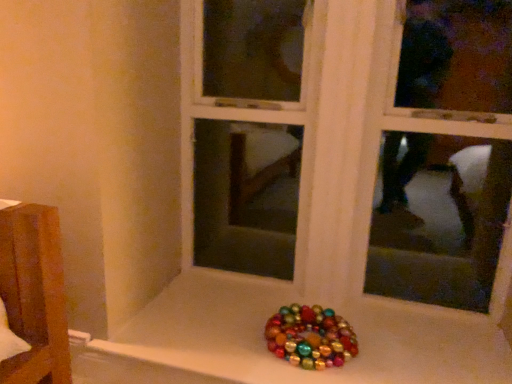
Question: Is multicolored glossy beads at bottom center looking in the opposite direction of metallic shiny ornaments at bottom?

Choices:
 (A) yes
 (B) no

Answer: (A)

Question: Is multicolored glossy beads at bottom center at the right side of metallic shiny ornaments at bottom?

Choices:
 (A) no
 (B) yes

Answer: (A)

Question: Can you confirm if multicolored glossy beads at bottom center is thinner than metallic shiny ornaments at bottom?

Choices:
 (A) no
 (B) yes

Answer: (A)

Question: Considering the relative sizes of multicolored glossy beads at bottom center and metallic shiny ornaments at bottom in the image provided, is multicolored glossy beads at bottom center smaller than metallic shiny ornaments at bottom?

Choices:
 (A) no
 (B) yes

Answer: (B)

Question: Is multicolored glossy beads at bottom center taller than metallic shiny ornaments at bottom?

Choices:
 (A) no
 (B) yes

Answer: (A)

Question: From the image's perspective, is multicolored glossy beads at bottom center below metallic shiny ornaments at bottom?

Choices:
 (A) no
 (B) yes

Answer: (B)

Question: Can you confirm if metallic shiny ornaments at bottom is wider than multicolored glossy beads at bottom center?

Choices:
 (A) yes
 (B) no

Answer: (B)

Question: Is metallic shiny ornaments at bottom to the right of multicolored glossy beads at bottom center from the viewer's perspective?

Choices:
 (A) yes
 (B) no

Answer: (A)

Question: Is metallic shiny ornaments at bottom looking in the opposite direction of multicolored glossy beads at bottom center?

Choices:
 (A) no
 (B) yes

Answer: (A)

Question: Does metallic shiny ornaments at bottom have a larger size compared to multicolored glossy beads at bottom center?

Choices:
 (A) yes
 (B) no

Answer: (A)

Question: From a real-world perspective, is metallic shiny ornaments at bottom located beneath multicolored glossy beads at bottom center?

Choices:
 (A) no
 (B) yes

Answer: (A)

Question: Is metallic shiny ornaments at bottom at the left side of multicolored glossy beads at bottom center?

Choices:
 (A) yes
 (B) no

Answer: (B)

Question: Considering the positions of metallic shiny ornaments at bottom and multicolored glossy beads at bottom center in the image, is metallic shiny ornaments at bottom wider or thinner than multicolored glossy beads at bottom center?

Choices:
 (A) thin
 (B) wide

Answer: (A)